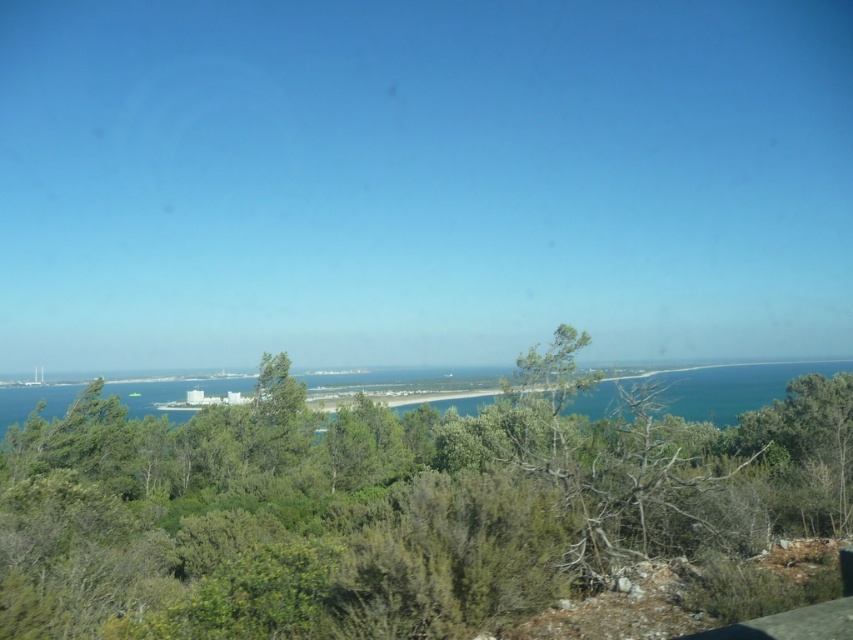
Is green leafy tree at center bigger than blue water at center?

No, green leafy tree at center is not bigger than blue water at center.

Between point (358, 440) and point (686, 380), which one is positioned in front?

Point (358, 440) is in front.

At what (x,y) coordinates should I click in order to perform the action: click on green leafy tree at center. Please return your answer as a coordinate pair (x, y). The image size is (853, 640). Looking at the image, I should click on (387, 506).